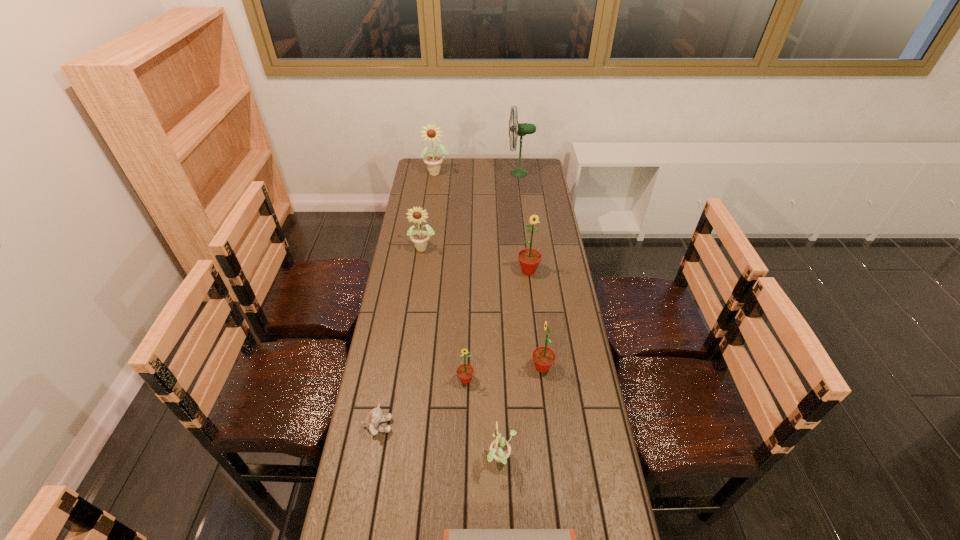
Where is `sunflower positioned at the far edge`? sunflower positioned at the far edge is located at coordinates (431, 133).

This screenshot has width=960, height=540. What are the coordinates of `teddy bear located in the left edge section of the desktop` in the screenshot? It's located at (376, 416).

The image size is (960, 540). In order to click on fan present at the right edge in this screenshot , I will do `click(519, 129)`.

Find the location of a particular element. object positioned at the far left corner is located at coordinates (431, 133).

The width and height of the screenshot is (960, 540). In order to click on object located in the far right corner section of the desktop in this screenshot , I will do `click(519, 129)`.

Locate an element on the screen. This screenshot has width=960, height=540. vacant area at the far edge is located at coordinates (455, 159).

Identify the location of free space at the left edge of the desktop. The width and height of the screenshot is (960, 540). (396, 411).

Locate an element on the screen. vacant region at the far right corner of the desktop is located at coordinates (532, 164).

Locate an element on the screen. This screenshot has height=540, width=960. vacant point located between the fifth nearest sunflower and the tallest object is located at coordinates (471, 210).

Where is `free space between the leftmost green sunflower and the second smallest yellow sunflower`? Image resolution: width=960 pixels, height=540 pixels. free space between the leftmost green sunflower and the second smallest yellow sunflower is located at coordinates (444, 314).